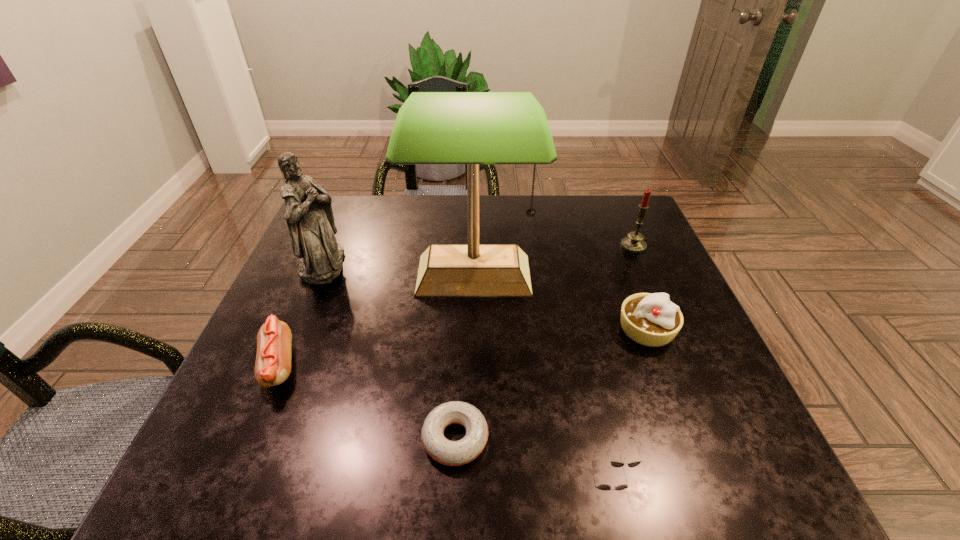
This screenshot has width=960, height=540. I want to click on table lamp, so click(472, 128).

The image size is (960, 540). What are the coordinates of `the sixth shortest object` in the screenshot? It's located at (309, 215).

Where is `the third tallest object`? The image size is (960, 540). the third tallest object is located at coordinates (633, 243).

Identify the location of the fourth tallest object. (649, 319).

Locate an element on the screen. the fifth tallest object is located at coordinates (273, 359).

At what (x,y) coordinates should I click in order to perform the action: click on sunglasses. Please return your answer as a coordinate pair (x, y). Image resolution: width=960 pixels, height=540 pixels. Looking at the image, I should click on (617, 464).

The image size is (960, 540). Identify the location of the third object from right to left. (617, 464).

Locate an element on the screen. the shortest object is located at coordinates (451, 453).

Find the location of `free space located on the metallic stand of the table lamp`. free space located on the metallic stand of the table lamp is located at coordinates (470, 477).

At what (x,y) coordinates should I click in order to perform the action: click on vacant area situated 0.220m on the front-facing side of the figurine. Please return your answer as a coordinate pair (x, y). The width and height of the screenshot is (960, 540). Looking at the image, I should click on (430, 264).